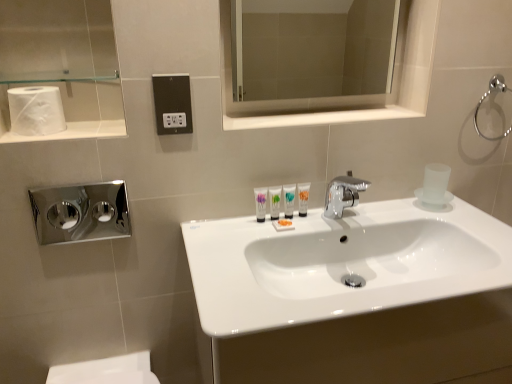
This screenshot has width=512, height=384. Identify the location of vacant space that's between matte white tube at center, which appears as the first mouthwash when viewed from the left, and polished chrome faucet at center. (296, 223).